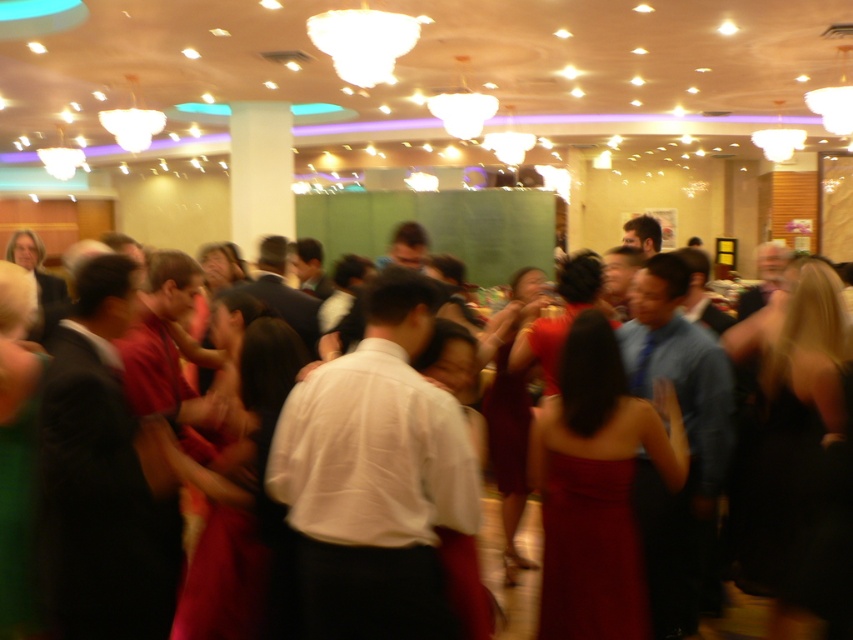
Question: Can you confirm if matte red dress at center is bigger than matte white dress at center?

Choices:
 (A) yes
 (B) no

Answer: (A)

Question: Which object appears closest to the camera in this image?

Choices:
 (A) matte red dress at center
 (B) matte white dress at center

Answer: (A)

Question: Can you confirm if matte white dress at center is smaller than velvet burgundy dress at center?

Choices:
 (A) no
 (B) yes

Answer: (B)

Question: Which of the following is the farthest from the observer?

Choices:
 (A) velvet burgundy dress at center
 (B) matte white dress at center

Answer: (A)

Question: Is matte red dress at center wider than matte white dress at center?

Choices:
 (A) yes
 (B) no

Answer: (A)

Question: Estimate the real-world distances between objects in this image. Which object is closer to the velvet burgundy dress at center?

Choices:
 (A) matte red dress at center
 (B) matte white dress at center

Answer: (A)